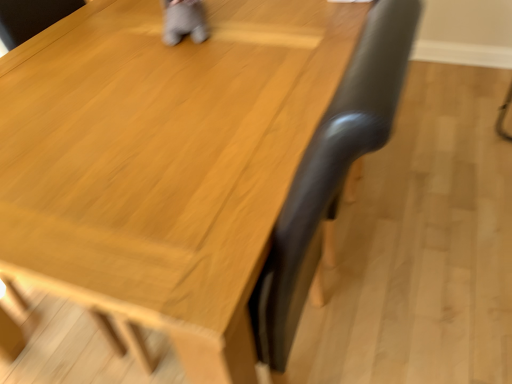
This screenshot has height=384, width=512. What do you see at coordinates (331, 173) in the screenshot?
I see `black leather swivel chair at right` at bounding box center [331, 173].

Identify the location of black leather swivel chair at right. Image resolution: width=512 pixels, height=384 pixels. tap(331, 173).

Locate an element on the screen. black leather swivel chair at right is located at coordinates (331, 173).